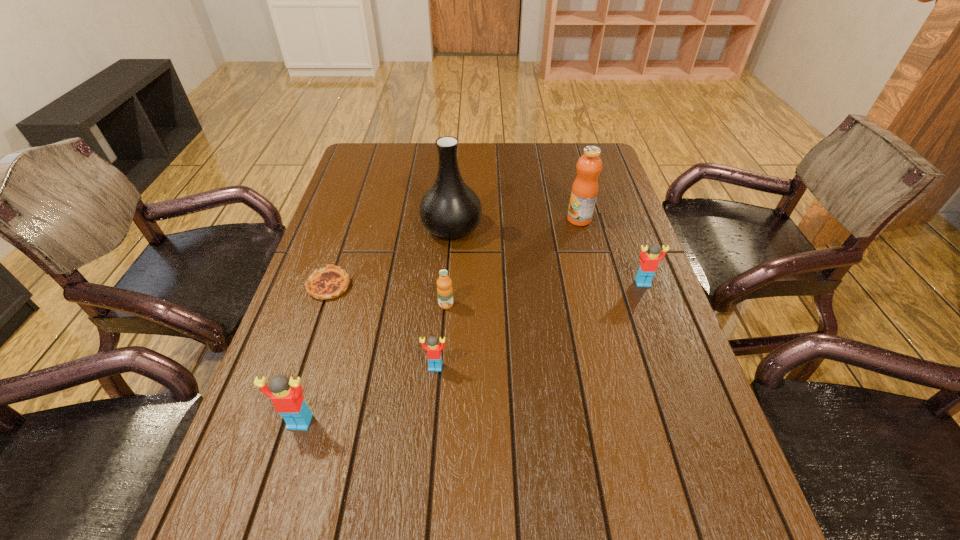
Find the location of a particular element. The image size is (960, 540). orange juice is located at coordinates 444,283.

Identify the location of vacant region located 0.050m on the face of the nearest Lego. This screenshot has height=540, width=960. (289, 456).

You are a GUI agent. You are given a task and a screenshot of the screen. Output one action in this format:
    pyautogui.click(x=<x>, y=<y>)
    Task: Click on the vacant space located on the face of the second nearest object
    
    Given the screenshot: What is the action you would take?
    point(429,449)

Identify the location of free space located on the face of the rightmost Lego. The width and height of the screenshot is (960, 540). (658, 323).

This screenshot has height=540, width=960. Identify the location of vacant space situated 0.070m on the left of the vase. (398, 228).

The width and height of the screenshot is (960, 540). Find the location of `vacant space positioned on the front of the shortest object`. vacant space positioned on the front of the shortest object is located at coordinates (305, 355).

Where is `vacant space positioned 0.270m on the left of the sixth shortest object`? The image size is (960, 540). vacant space positioned 0.270m on the left of the sixth shortest object is located at coordinates tap(478, 219).

Find the location of a particular element. This screenshot has height=540, width=960. vacant space located 0.110m on the label of the orange juice is located at coordinates (443, 347).

You are a GUI agent. You are given a task and a screenshot of the screen. Output one action in this format:
    pyautogui.click(x=<x>, y=<y>)
    Task: Click on the Lego located in the left edge section of the desktop
    This screenshot has width=960, height=540.
    Given the screenshot: What is the action you would take?
    pyautogui.click(x=286, y=396)

You are a GUI agent. You are given a task and a screenshot of the screen. Output one action in this format:
    pyautogui.click(x=<x>, y=<y>)
    Task: Click on the quiche present at the left edge
    
    Given the screenshot: What is the action you would take?
    pyautogui.click(x=330, y=282)